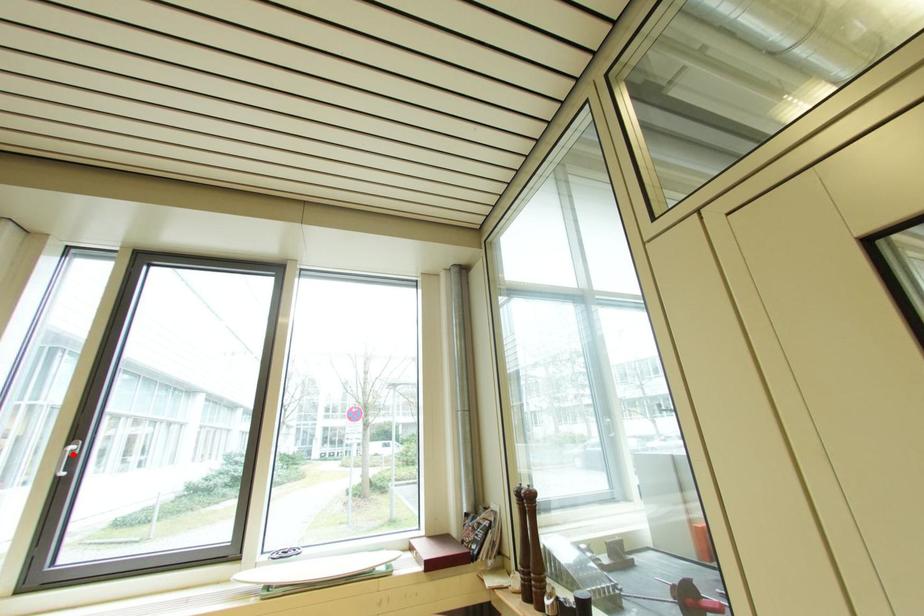
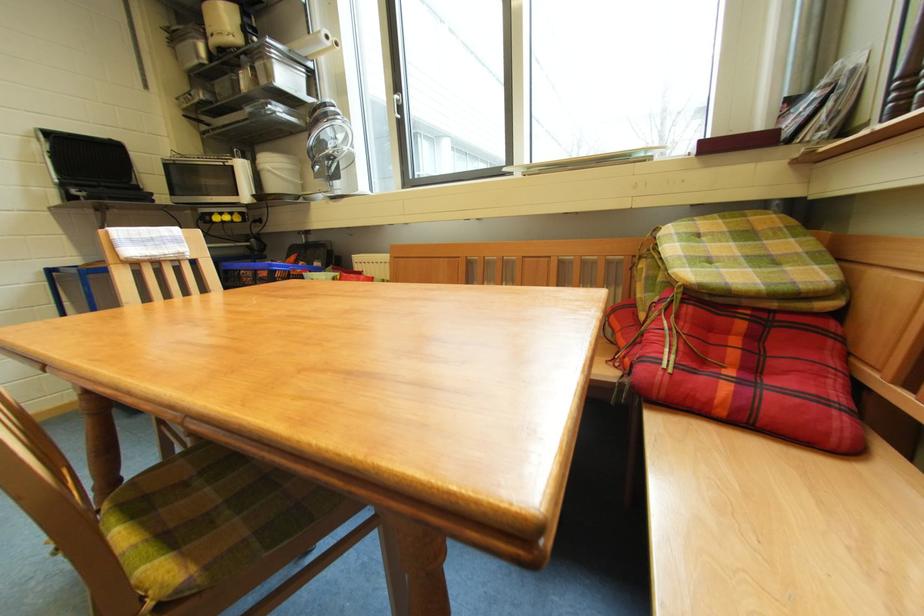
Locate, in the second image, the point that corresponds to the highlighted location in the first image.

(402, 102)